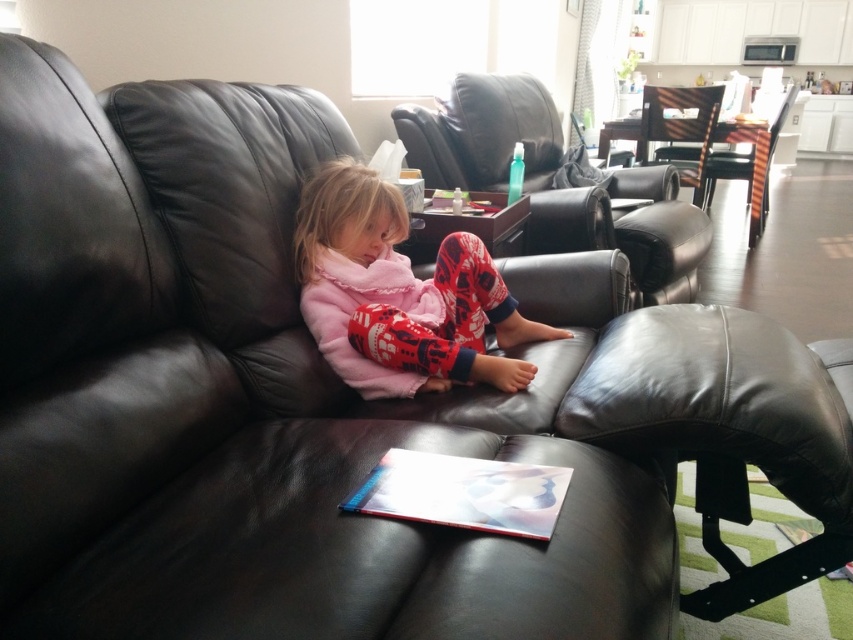
You are a guest in this living room and want to sit down. You see the pink fleece pajamas at center and the matte black armchair at center. Which object is closer to the left side of the room?

The pink fleece pajamas at center is to the left of the matte black armchair at center, so it is closer to the left side of the room.

You are a delivery robot standing at the viewer position in the living room. You need to place a package on the black leather ottoman at lower right. Can you reach it without moving closer than 1 meter?

The distance between the black leather ottoman at lower right and the viewer is 1.01 meters, so yes, the delivery robot can reach it without moving closer than 1 meter since the distance is just over 1 meter.